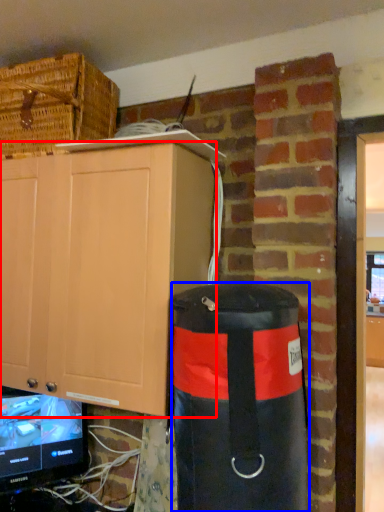
Question: Which object is closer to the camera taking this photo, cabinetry (highlighted by a red box) or punching bag (highlighted by a blue box)?

Choices:
 (A) cabinetry
 (B) punching bag

Answer: (B)